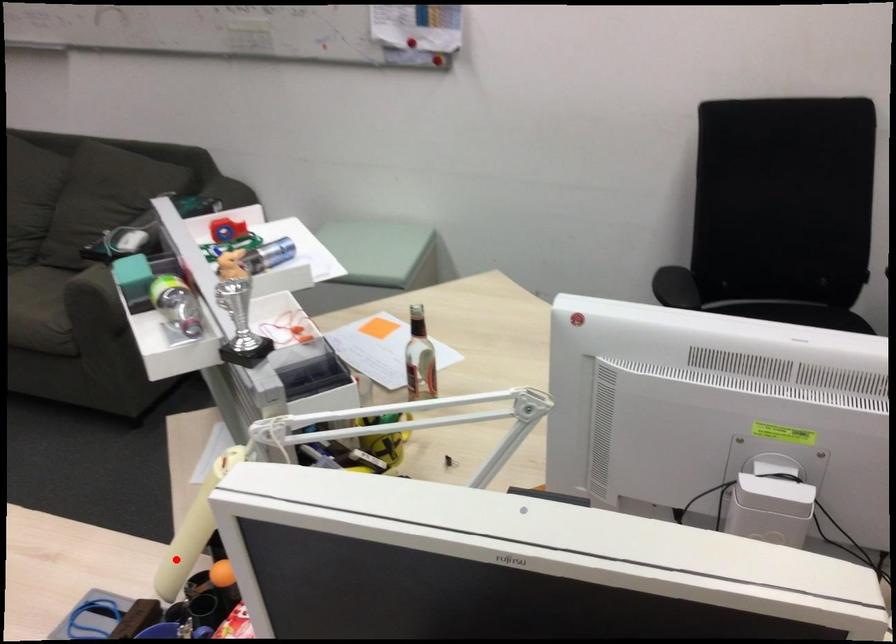
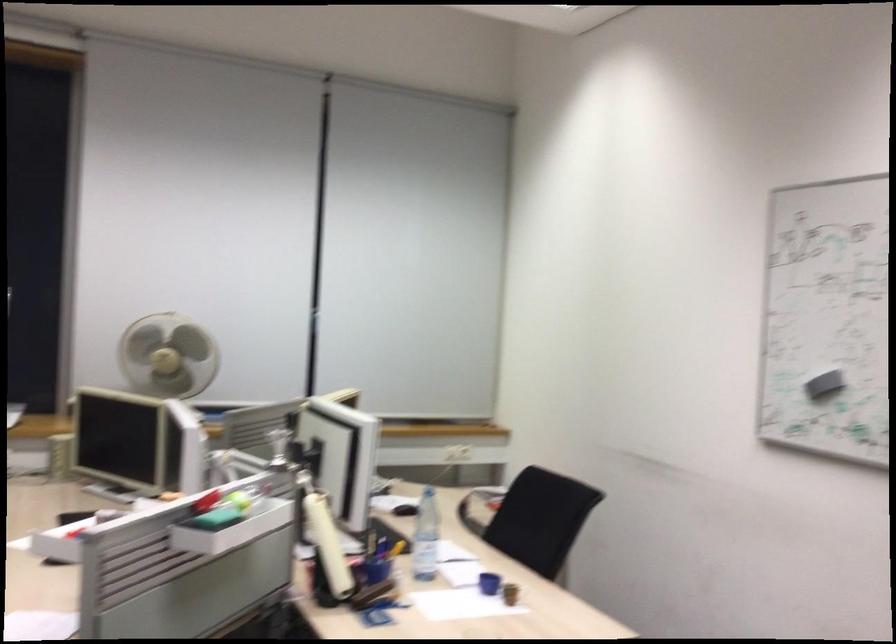
The point at the highlighted location is marked in the first image. Where is the corresponding point in the second image?

(328, 545)